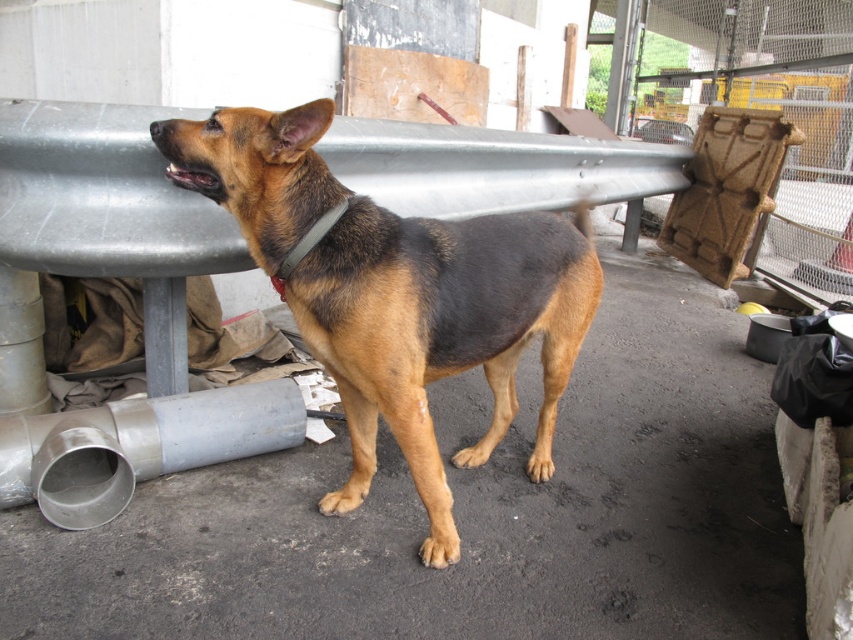
You are a delivery person who needs to place a new silver metallic pipe at lower left in the construction area. Where exactly should you place it according to the coordinates provided?

The silver metallic pipe at lower left should be placed at the coordinates point (x=137, y=445) as specified.

You are a photographer taking a picture of the German Shepherd dog in the construction area. You notice two points marked in the image. The first point is at coordinate point (x=39, y=456) and the second point is at coordinate point (x=331, y=225). Which point is closer to the camera?

Point (x=331, y=225) is closer to the camera than point (x=39, y=456) because the description states that point (x=39, y=456) is further away.

You are a delivery person who needs to place a package on the silver metallic pipe at lower left. The brown fur dog at center is in the way. Which direction should you move the dog to make space?

The brown fur dog at center is on the right side of the silver metallic pipe at lower left, so you should move the dog to the left to make space.